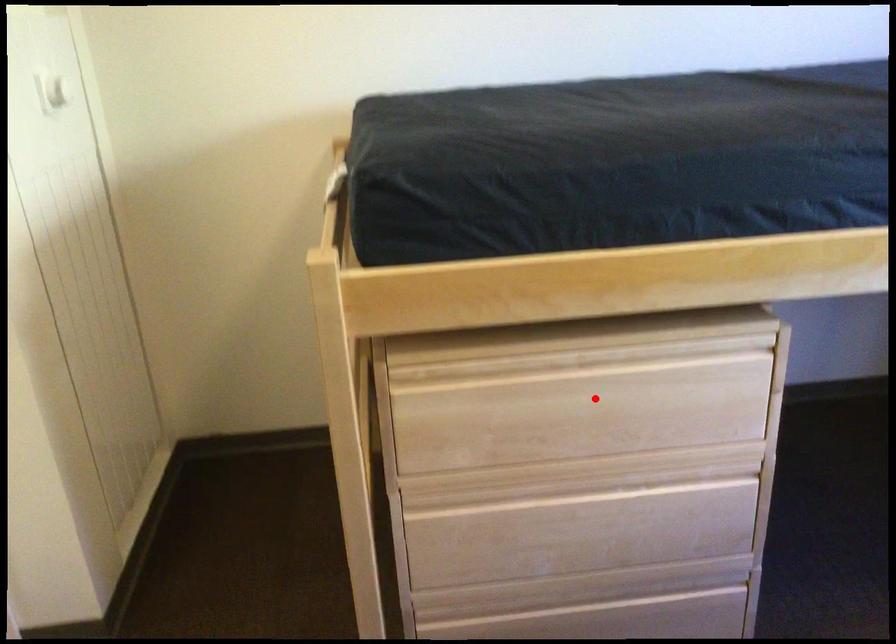
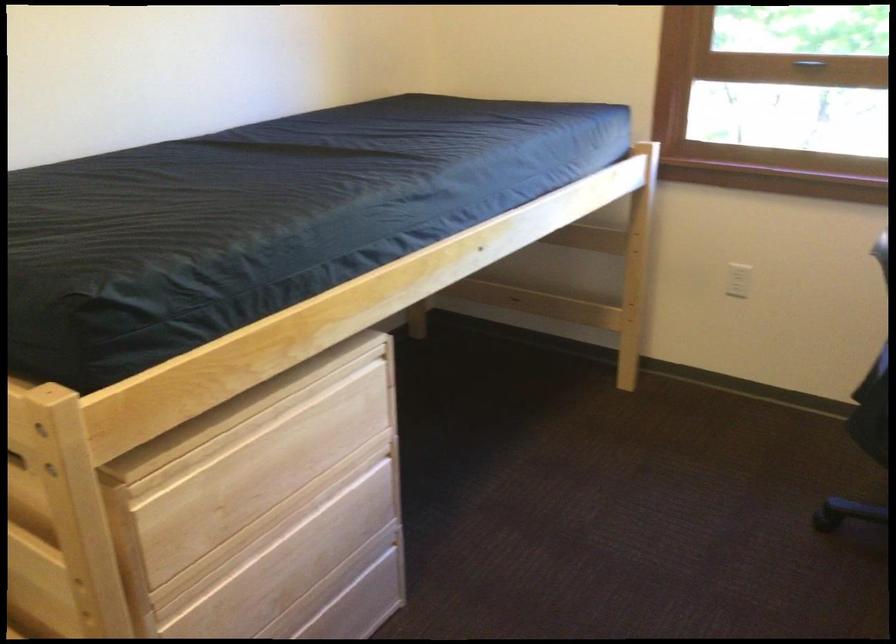
Question: I am providing you with two images of the same scene from different viewpoints. Given a red point in image1, look at the same physical point in image2. Is it:

Choices:
 (A) Closer to the viewpoint
 (B) Farther from the viewpoint

Answer: (B)